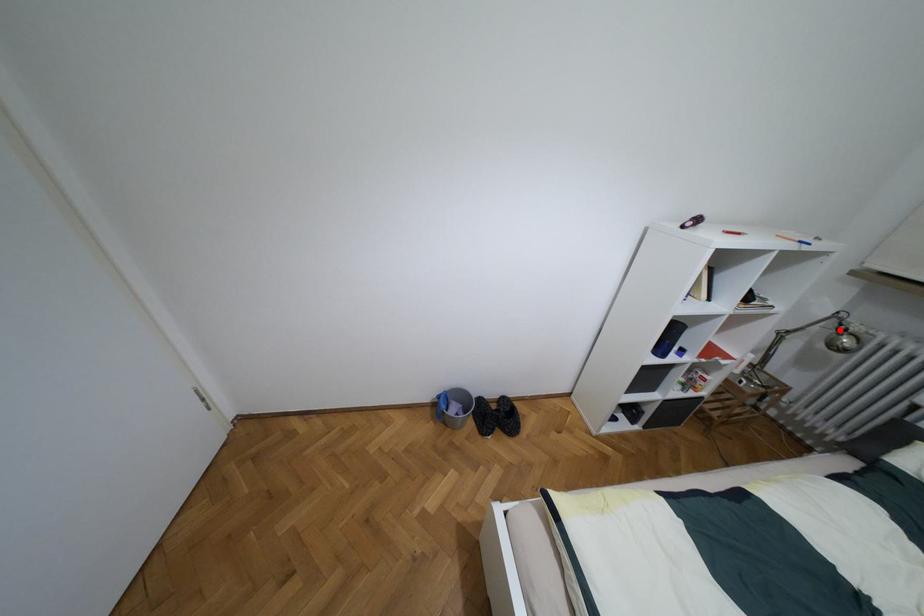
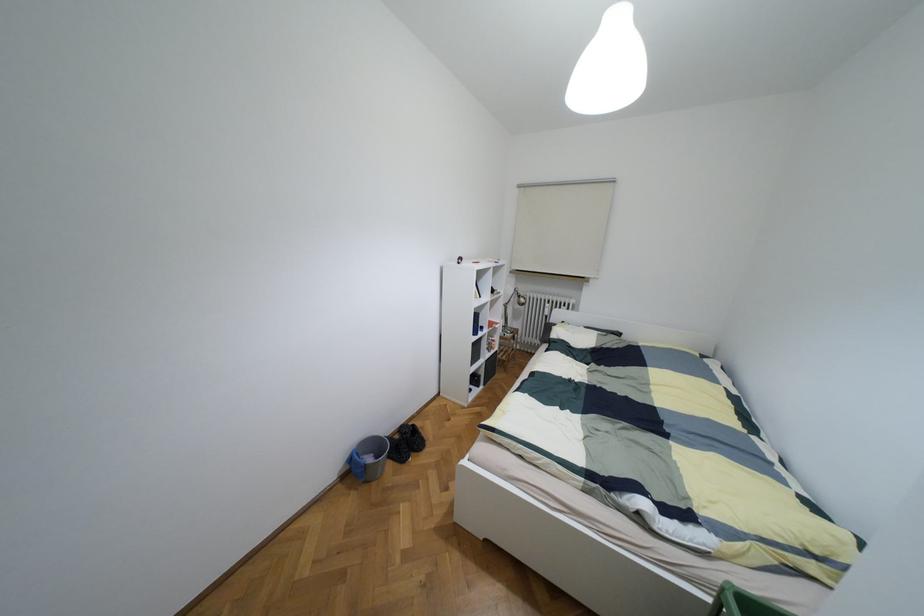
Question: I am providing you with two images of the same scene from different viewpoints. A red point is shown in image1. For the corresponding object point in image2, is it positioned nearer or farther from the camera?

Choices:
 (A) Nearer
 (B) Farther

Answer: (A)